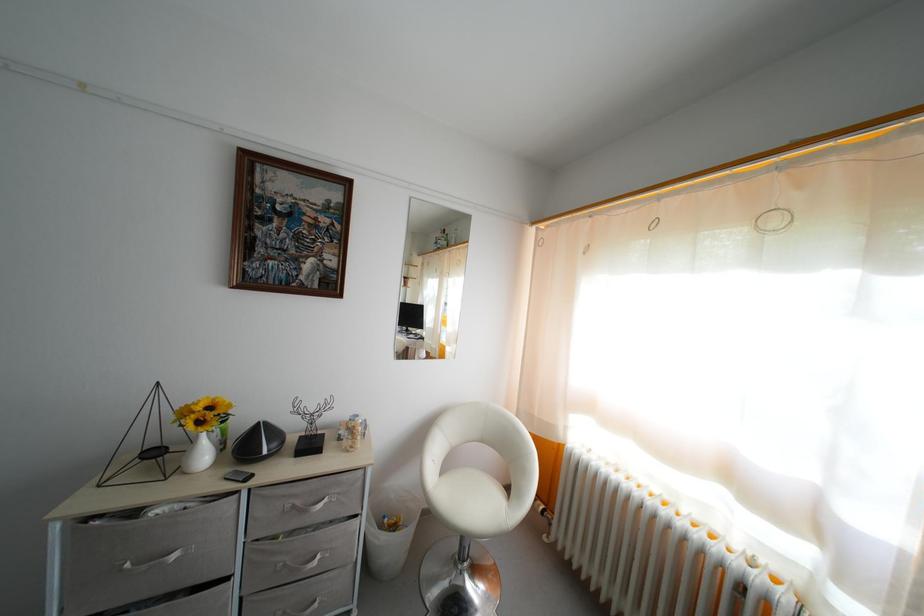
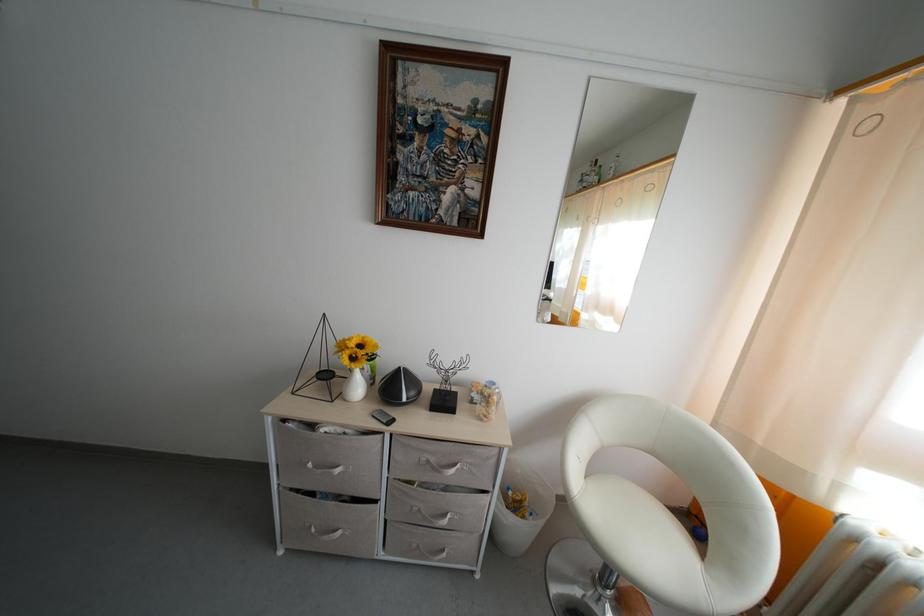
Find the pixel in the second image that matches point 304,509 in the first image.

(439, 466)